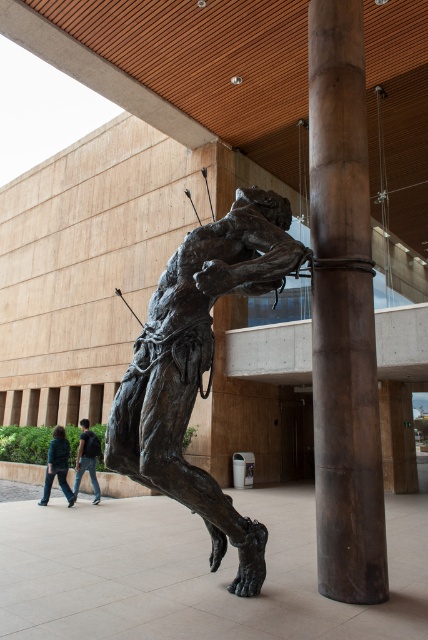
Is smooth brown wood at center taller than jeans at lower left?

Yes, smooth brown wood at center is taller than jeans at lower left.

Between smooth brown wood at center and jeans at lower left, which one appears on the left side from the viewer's perspective?

Positioned to the left is jeans at lower left.

This screenshot has height=640, width=428. What do you see at coordinates (344, 314) in the screenshot?
I see `smooth brown wood at center` at bounding box center [344, 314].

At what (x,y) coordinates should I click in order to perform the action: click on smooth brown wood at center. Please return your answer as a coordinate pair (x, y). Looking at the image, I should click on (344, 314).

Is smooth brown wood at center wider than bronze textured figure at center?

In fact, smooth brown wood at center might be narrower than bronze textured figure at center.

Which is behind, point (321, 212) or point (208, 296)?

The point (321, 212) is behind.

Identify the location of smooth brown wood at center. [344, 314].

Does bronze textured figure at center have a greater height compared to green denim jacket at lower left?

Indeed, bronze textured figure at center has a greater height compared to green denim jacket at lower left.

Can you confirm if bronze textured figure at center is bigger than green denim jacket at lower left?

Indeed, bronze textured figure at center has a larger size compared to green denim jacket at lower left.

The height and width of the screenshot is (640, 428). I want to click on bronze textured figure at center, so click(x=199, y=365).